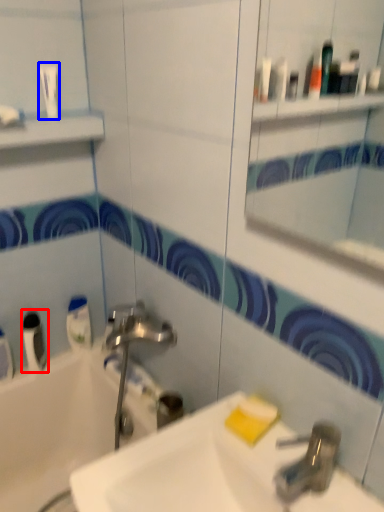
Question: Which object is closer to the camera taking this photo, mouthwash (highlighted by a red box) or toiletry (highlighted by a blue box)?

Choices:
 (A) mouthwash
 (B) toiletry

Answer: (B)